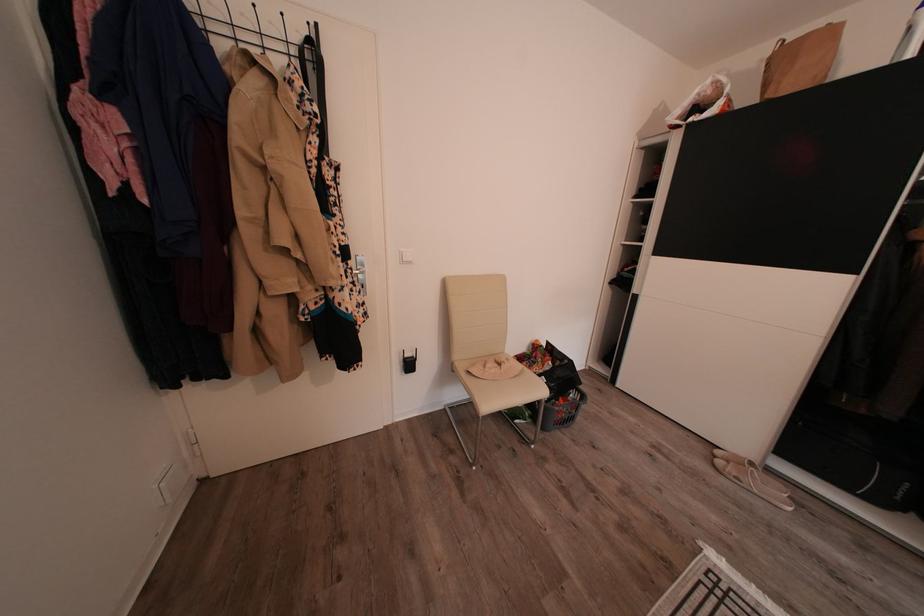
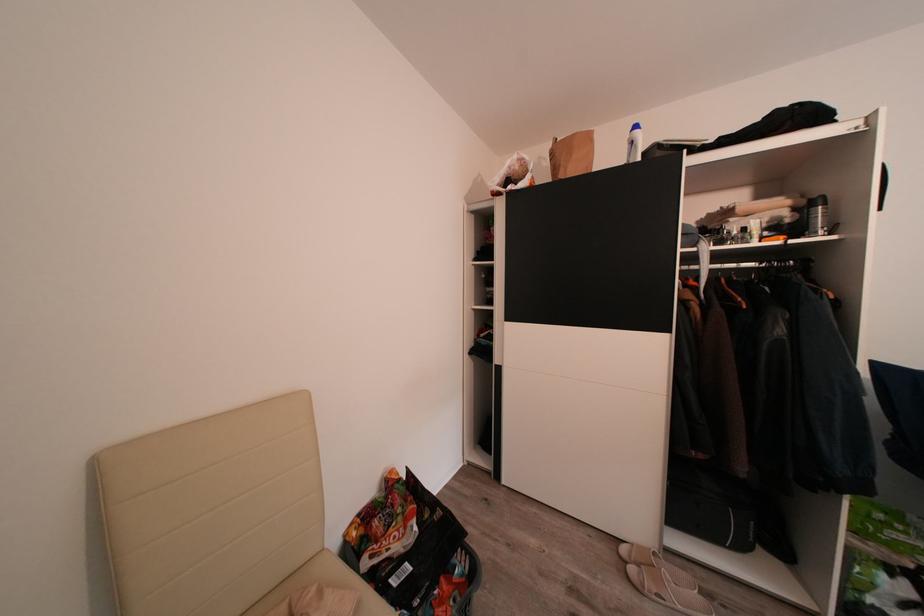
In the second image, find the point that corresponds to point (727, 458) in the first image.

(631, 554)